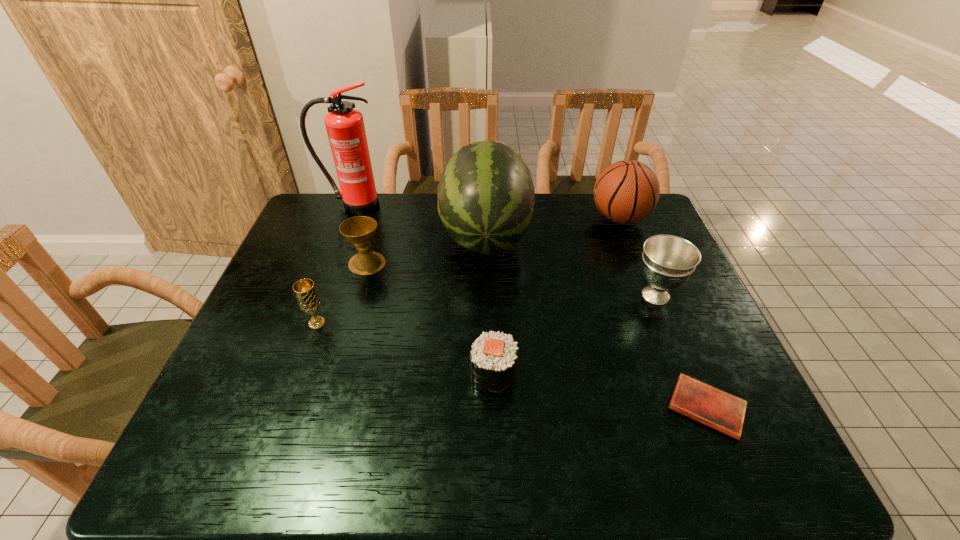
You are a GUI agent. You are given a task and a screenshot of the screen. Output one action in this format:
    pyautogui.click(x=<x>, y=<y>)
    Task: Click on the vacant space that satisfies the following two spatial constraints: 1. at the nozzle of the tallest object; 2. on the right side of the second shortest object
    This screenshot has width=960, height=540.
    Given the screenshot: What is the action you would take?
    pyautogui.click(x=291, y=375)

Identify the location of free region that satisfies the following two spatial constraints: 1. on the side where the inflation valve is located; 2. on the left side of the rightmost chalice. (650, 295).

This screenshot has height=540, width=960. In order to click on free spot that satisfies the following two spatial constraints: 1. on the side where the inflation valve is located; 2. on the right side of the diary in this screenshot , I will do `click(694, 407)`.

This screenshot has height=540, width=960. I want to click on vacant space that satisfies the following two spatial constraints: 1. on the front side of the seventh tallest object; 2. on the right side of the farthest chalice, so click(335, 375).

This screenshot has height=540, width=960. I want to click on vacant region that satisfies the following two spatial constraints: 1. on the back side of the sixth farthest object; 2. on the left side of the watermelon, so click(x=348, y=234).